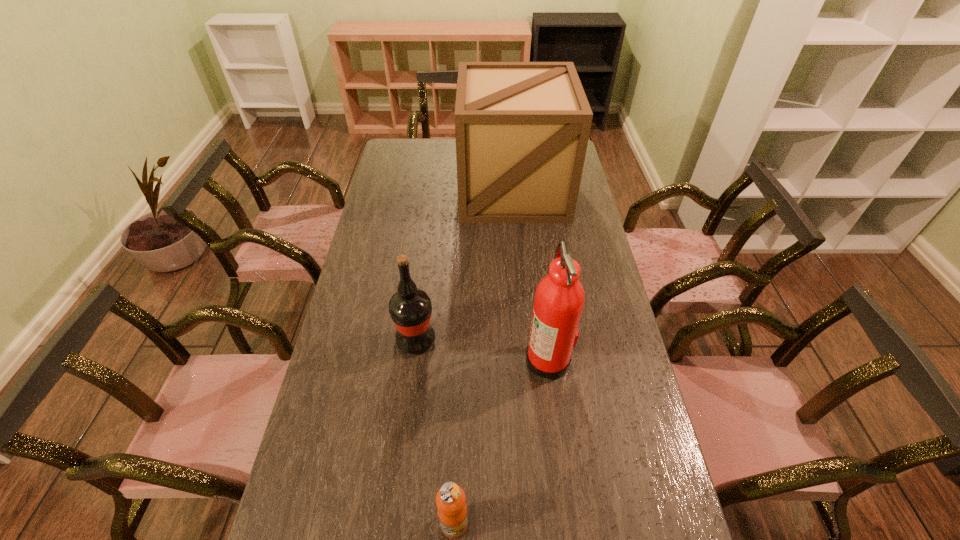
The height and width of the screenshot is (540, 960). I want to click on vacant area that lies between the fire extinguisher and the shortest object, so click(x=501, y=441).

Where is `free point between the third tallest object and the farthest object`? The image size is (960, 540). free point between the third tallest object and the farthest object is located at coordinates (465, 265).

Image resolution: width=960 pixels, height=540 pixels. What are the coordinates of `free space between the farthest object and the fruit juice` in the screenshot? It's located at (484, 356).

Locate which object ranks third in proximity to the leftmost object. Please provide its 2D coordinates. Your answer should be formatted as a tuple, i.e. [(x, y)], where the tuple contains the x and y coordinates of a point satisfying the conditions above.

[(522, 128)]

Locate which object ranks third in proximity to the leftmost object. Please provide its 2D coordinates. Your answer should be formatted as a tuple, i.e. [(x, y)], where the tuple contains the x and y coordinates of a point satisfying the conditions above.

[(522, 128)]

Where is `free space that satisfies the following two spatial constraints: 1. on the label side of the fire extinguisher; 2. on the front side of the nearest object`? This screenshot has width=960, height=540. free space that satisfies the following two spatial constraints: 1. on the label side of the fire extinguisher; 2. on the front side of the nearest object is located at coordinates (568, 523).